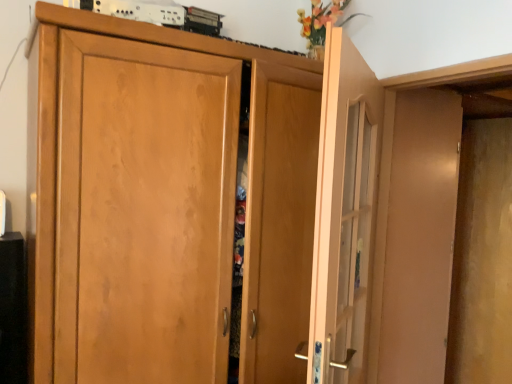
This screenshot has width=512, height=384. In order to click on light wood door at center in this screenshot , I will do `click(343, 214)`.

This screenshot has width=512, height=384. What do you see at coordinates (343, 214) in the screenshot?
I see `light wood door at center` at bounding box center [343, 214].

Locate an element on the screen. light wood door at center is located at coordinates (343, 214).